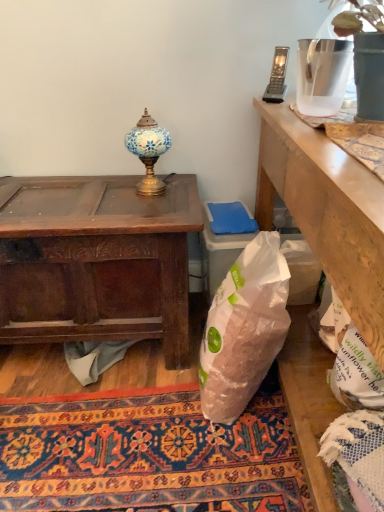
This screenshot has width=384, height=512. I want to click on space that is in front of dark brown wood desk at left, so click(131, 436).